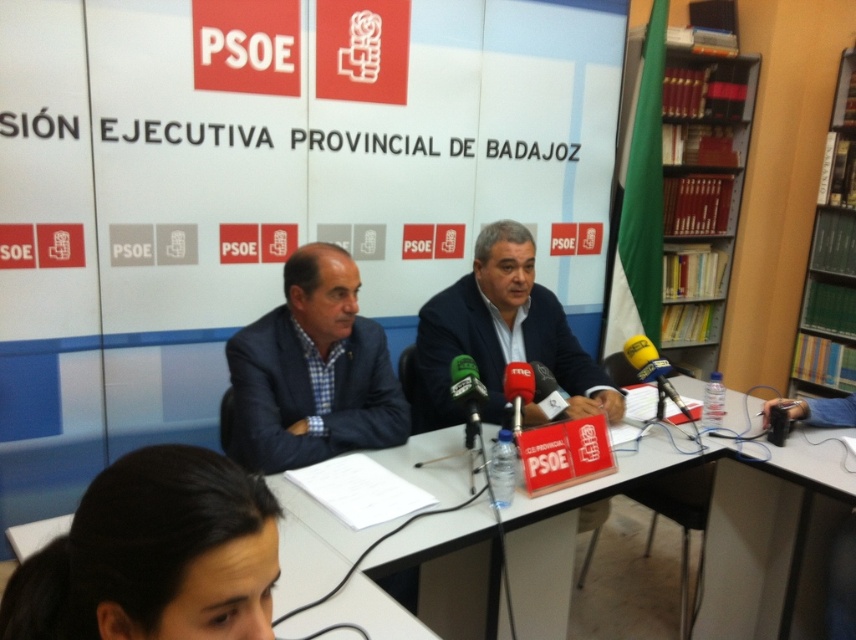
Question: Which point is closer to the camera?

Choices:
 (A) (467, 426)
 (B) (538, 326)

Answer: (A)

Question: Can you confirm if blue fabric suit at center is positioned above dark blue suit at center?

Choices:
 (A) yes
 (B) no

Answer: (A)

Question: From the image, what is the correct spatial relationship of dark brown hair at lower left in relation to red matte microphone at center?

Choices:
 (A) right
 (B) left

Answer: (B)

Question: Is white plastic table at center thinner than red matte microphone at center?

Choices:
 (A) yes
 (B) no

Answer: (B)

Question: Which point is closer to the camera taking this photo?

Choices:
 (A) (471, 435)
 (B) (730, 72)

Answer: (A)

Question: Which object is closer to the camera taking this photo?

Choices:
 (A) dark blue suit at center
 (B) red matte microphone at center
 (C) hardcover books at right

Answer: (B)